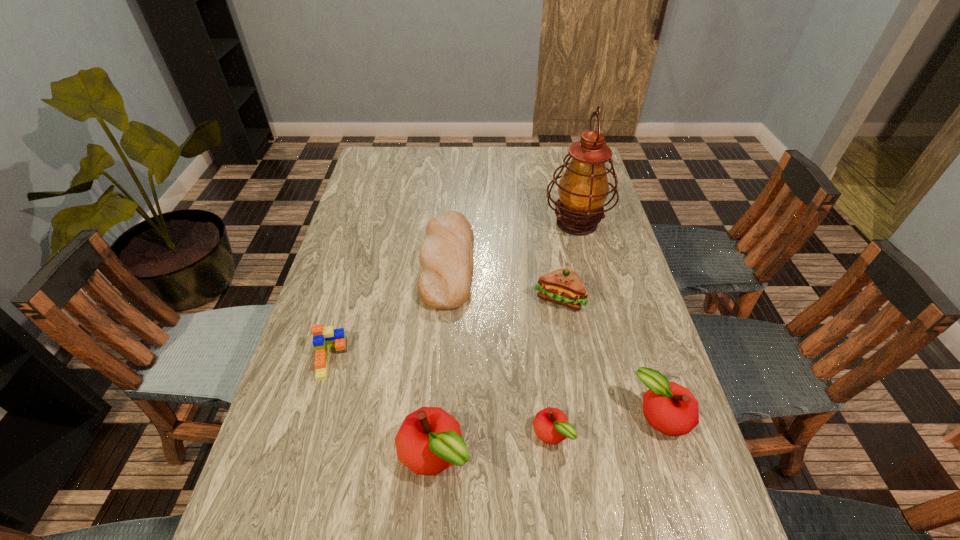
Locate an element on the screen. vacant region at the far edge of the desktop is located at coordinates (430, 148).

Image resolution: width=960 pixels, height=540 pixels. Identify the location of vacant area at the near edge of the desktop. (401, 516).

Where is `blank space at the left edge`? Image resolution: width=960 pixels, height=540 pixels. blank space at the left edge is located at coordinates (354, 222).

At what (x,y) coordinates should I click in order to perform the action: click on free space at the near left corner of the desktop. Please return your answer as a coordinate pair (x, y). This screenshot has height=540, width=960. Looking at the image, I should click on (272, 488).

This screenshot has height=540, width=960. I want to click on free space at the far right corner, so click(563, 157).

This screenshot has width=960, height=540. I want to click on free space between the Lego and the sandwich, so point(444,329).

At what (x,y) coordinates should I click in order to perform the action: click on vacant area that lies between the rightmost apple and the oil lamp. Please return your answer as a coordinate pair (x, y). This screenshot has height=540, width=960. Looking at the image, I should click on [x=619, y=319].

Locate an element on the screen. The image size is (960, 540). unoccupied area between the bread and the leftmost apple is located at coordinates (441, 357).

The height and width of the screenshot is (540, 960). What are the coordinates of `blank region between the second apple from right to left and the fourth farthest object` in the screenshot? It's located at (441, 396).

Where is `vacant area that lies between the rightmost apple and the bread`? vacant area that lies between the rightmost apple and the bread is located at coordinates (555, 339).